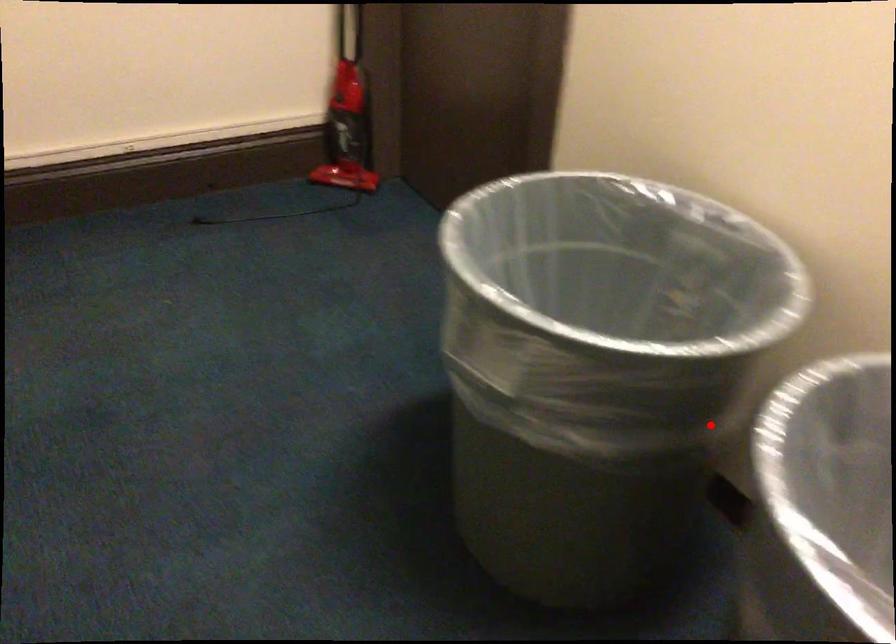
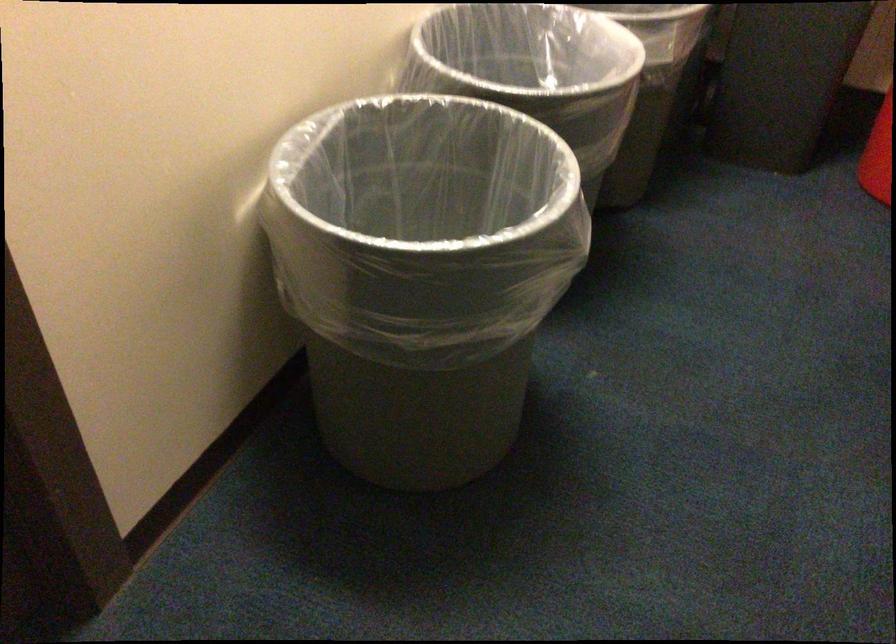
In the second image, find the point that corresponds to the highlighted location in the first image.

(410, 231)